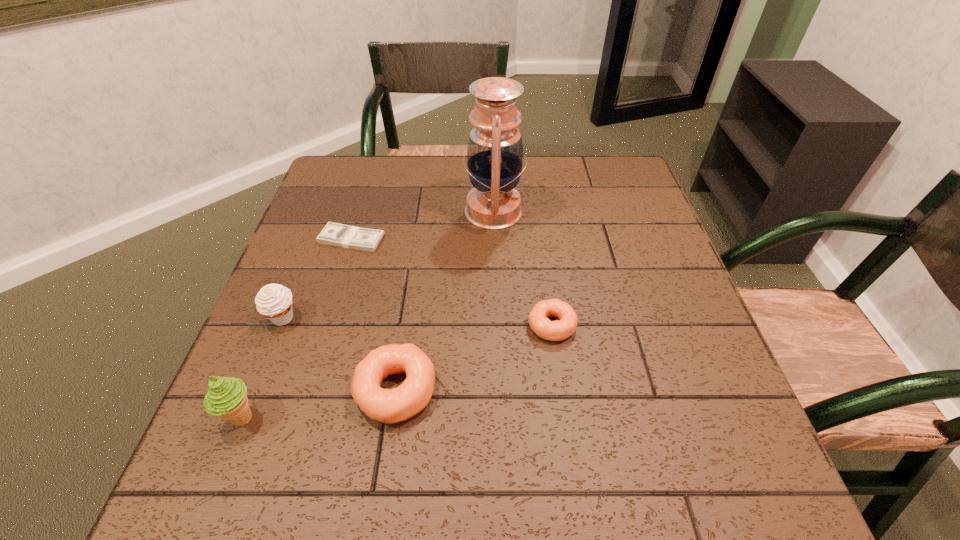
In order to click on object that is positioned at the near left corner in this screenshot , I will do `click(226, 397)`.

Locate an element on the screen. Image resolution: width=960 pixels, height=540 pixels. free space at the far edge is located at coordinates (455, 193).

The image size is (960, 540). In order to click on free space at the near edge in this screenshot , I will do `click(332, 402)`.

Find the location of a particular element. vacant space at the right edge of the desktop is located at coordinates (697, 347).

Where is `vacant space at the far left corner of the desktop`? The width and height of the screenshot is (960, 540). vacant space at the far left corner of the desktop is located at coordinates (354, 159).

Identify the location of vacant space that's between the left doughnut and the icecream. (319, 404).

Locate an element on the screen. This screenshot has width=960, height=540. free space between the left doughnut and the shortest object is located at coordinates (373, 315).

Find the location of a particular element. The image size is (960, 540). free space between the second shortest object and the fourth shortest object is located at coordinates (418, 322).

What are the coordinates of `free space between the second tallest object and the muffin` in the screenshot? It's located at (263, 368).

Locate an element on the screen. Image resolution: width=960 pixels, height=540 pixels. free space between the left doughnut and the shortest object is located at coordinates (373, 315).